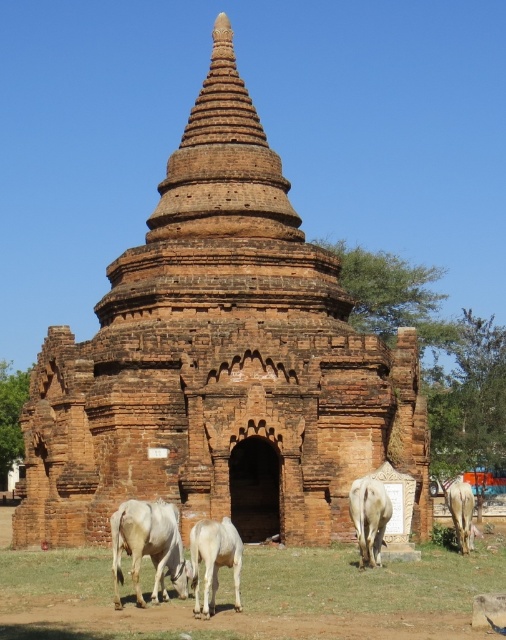
Between point (131, 301) and point (495, 577), which one is positioned behind?

The point (131, 301) is behind.

Between reddish-brown brick pagoda at center and green grass at lower center, which one appears on the left side from the viewer's perspective?

From the viewer's perspective, reddish-brown brick pagoda at center appears more on the left side.

Find the location of a particular element. The width and height of the screenshot is (506, 640). reddish-brown brick pagoda at center is located at coordinates point(220,362).

Identify the location of reddish-brown brick pagoda at center. (220, 362).

What do you see at coordinates (368, 580) in the screenshot?
I see `green grass at lower center` at bounding box center [368, 580].

Is point (343, 563) farther from camera compared to point (360, 547)?

Yes.

Image resolution: width=506 pixels, height=640 pixels. Identify the location of green grass at lower center. (368, 580).

In the scene shown: Is green grass at lower center taller than white smooth cow at lower left?

Incorrect, green grass at lower center's height is not larger of white smooth cow at lower left's.

Who is positioned more to the left, green grass at lower center or white smooth cow at lower left?

Positioned to the left is white smooth cow at lower left.

Who is more distant from viewer, (149, 588) or (152, 508)?

The point (149, 588) is behind.

Identify the location of green grass at lower center. (368, 580).